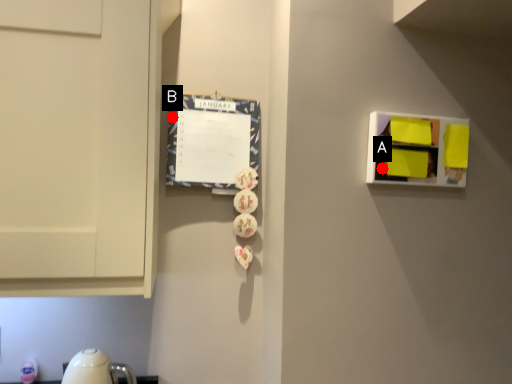
Question: Two points are circled on the image, labeled by A and B beside each circle. Among these points, which one is farthest from the camera?

Choices:
 (A) A is further
 (B) B is further

Answer: (B)